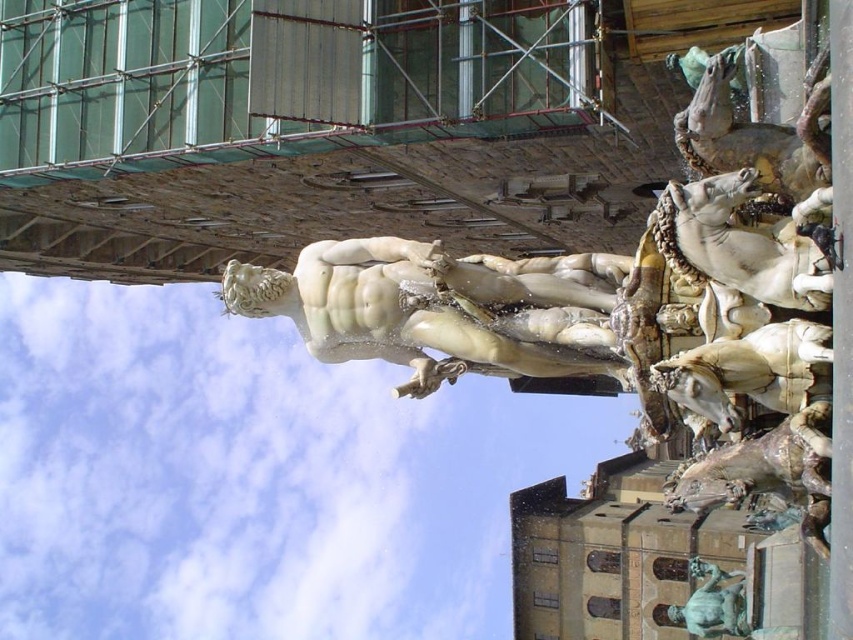
Question: Which point is farther to the camera?

Choices:
 (A) (712, 627)
 (B) (355, 280)

Answer: (A)

Question: Which point is closer to the camera?

Choices:
 (A) (389, 349)
 (B) (740, 611)

Answer: (A)

Question: Is white marble statue at center positioned at the back of bronze statue at lower right?

Choices:
 (A) no
 (B) yes

Answer: (A)

Question: Can you confirm if white marble statue at center is positioned to the left of bronze statue at lower right?

Choices:
 (A) no
 (B) yes

Answer: (B)

Question: Which object appears farthest from the camera in this image?

Choices:
 (A) white marble statue at center
 (B) bronze statue at lower right

Answer: (B)

Question: Can you confirm if white marble statue at center is thinner than bronze statue at lower right?

Choices:
 (A) no
 (B) yes

Answer: (B)